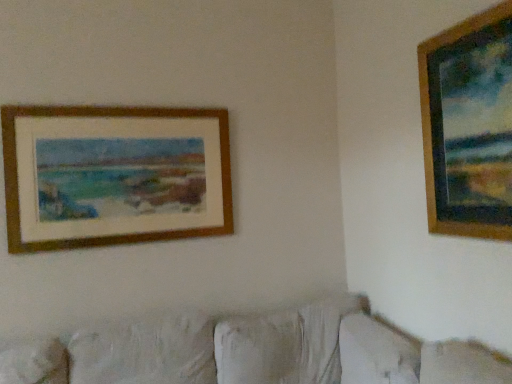
Where is `wooden frame at upper left, marked as the 1th picture frame in a back-to-front arrangement`? wooden frame at upper left, marked as the 1th picture frame in a back-to-front arrangement is located at coordinates (114, 175).

Is wooden frame at upper right, placed as the second picture frame when sorted from left to right, touching white fabric couch at lower center?

wooden frame at upper right, placed as the second picture frame when sorted from left to right, and white fabric couch at lower center are clearly separated.

Considering the relative sizes of wooden frame at upper right, arranged as the second picture frame when viewed from the back, and white fabric couch at lower center in the image provided, is wooden frame at upper right, arranged as the second picture frame when viewed from the back, bigger than white fabric couch at lower center?

No.

Does wooden frame at upper right, acting as the 1th picture frame starting from the front, contain white fabric couch at lower center?

That's incorrect, white fabric couch at lower center is not inside wooden frame at upper right, acting as the 1th picture frame starting from the front.

Which picture frame is the 1st one when counting from the back of the white fabric couch at lower center? Please provide its 2D coordinates.

[(449, 128)]

Looking at this image, from the image's perspective, is wooden frame at upper left, marked as the 1th picture frame in a back-to-front arrangement, on white fabric couch at lower center?

Yes.

Could you measure the distance between wooden frame at upper left, the 2th picture frame viewed from the right, and white fabric couch at lower center?

The distance of wooden frame at upper left, the 2th picture frame viewed from the right, from white fabric couch at lower center is 30.13 inches.

Between wooden frame at upper left, which appears as the second picture frame when viewed from the front, and white fabric couch at lower center, which one appears on the right side from the viewer's perspective?

white fabric couch at lower center is more to the right.

From a real-world perspective, which picture frame is the 1st one above the white fabric couch at lower center? Please provide its 2D coordinates.

[(114, 175)]

Between wooden frame at upper right, arranged as the second picture frame when viewed from the back, and wooden frame at upper left, which appears as the second picture frame when viewed from the front, which one has smaller size?

wooden frame at upper right, arranged as the second picture frame when viewed from the back, is smaller.

Considering the points (445, 227) and (80, 239), which point is behind, point (445, 227) or point (80, 239)?

The point (80, 239) is behind.

From a real-world perspective, which object stands above the other?

In real-world perspective, wooden frame at upper right, placed as the second picture frame when sorted from left to right, is above.

Which of these two, wooden frame at upper left, marked as the 1th picture frame in a back-to-front arrangement, or wooden frame at upper right, acting as the 1th picture frame starting from the front, is smaller?

wooden frame at upper right, acting as the 1th picture frame starting from the front, is smaller.

Does wooden frame at upper left, the first picture frame from the left, turn towards wooden frame at upper right, which is the 1th picture frame in right-to-left order?

No, wooden frame at upper left, the first picture frame from the left, is not facing towards wooden frame at upper right, which is the 1th picture frame in right-to-left order.

Which is less distant, [12,136] or [438,56]?

Point [12,136] appears to be farther away from the viewer than point [438,56].

Considering the points (173, 318) and (59, 158), which point is in front, point (173, 318) or point (59, 158)?

Point (59, 158)

How distant is white fabric couch at lower center from wooden frame at upper left, the first picture frame from the left?

They are 30.13 inches apart.

Based on the photo, is white fabric couch at lower center wider or thinner than wooden frame at upper left, the first picture frame from the left?

In the image, white fabric couch at lower center appears to be wider than wooden frame at upper left, the first picture frame from the left.

Is white fabric couch at lower center oriented towards wooden frame at upper left, which appears as the second picture frame when viewed from the front?

No.

Is white fabric couch at lower center smaller than wooden frame at upper right, which is the 1th picture frame in right-to-left order?

Incorrect, white fabric couch at lower center is not smaller in size than wooden frame at upper right, which is the 1th picture frame in right-to-left order.

Is there a large distance between white fabric couch at lower center and wooden frame at upper right, placed as the second picture frame when sorted from left to right?

They are positioned close to each other.

Consider the image. In the image, is white fabric couch at lower center positioned in front of or behind wooden frame at upper right, placed as the second picture frame when sorted from left to right?

white fabric couch at lower center is positioned closer to the viewer than wooden frame at upper right, placed as the second picture frame when sorted from left to right.

Is white fabric couch at lower center positioned with its back to wooden frame at upper right, which is the 1th picture frame in right-to-left order?

white fabric couch at lower center is not turned away from wooden frame at upper right, which is the 1th picture frame in right-to-left order.

Find the location of a particular element. This screenshot has width=512, height=384. couch lying in front of the wooden frame at upper right, which is the 1th picture frame in right-to-left order is located at coordinates (251, 352).

This screenshot has width=512, height=384. I want to click on couch that is below the wooden frame at upper left, the first picture frame from the left (from the image's perspective), so click(x=251, y=352).

From the picture: Which object lies nearer to the anchor point white fabric couch at lower center, wooden frame at upper right, acting as the 1th picture frame starting from the front, or wooden frame at upper left, the 2th picture frame viewed from the right?

wooden frame at upper left, the 2th picture frame viewed from the right, is positioned closer to the anchor white fabric couch at lower center.

From the image, which object appears to be farther from white fabric couch at lower center, wooden frame at upper left, the first picture frame from the left, or wooden frame at upper right, placed as the second picture frame when sorted from left to right?

Based on the image, wooden frame at upper right, placed as the second picture frame when sorted from left to right, appears to be further to white fabric couch at lower center.

Based on their spatial positions, is white fabric couch at lower center or wooden frame at upper right, placed as the second picture frame when sorted from left to right, further from wooden frame at upper left, the 2th picture frame viewed from the right?

wooden frame at upper right, placed as the second picture frame when sorted from left to right, lies further to wooden frame at upper left, the 2th picture frame viewed from the right, than the other object.

Consider the image. Estimate the real-world distances between objects in this image. Which object is further from wooden frame at upper right, arranged as the second picture frame when viewed from the back, white fabric couch at lower center or wooden frame at upper left, the first picture frame from the left?

The object further to wooden frame at upper right, arranged as the second picture frame when viewed from the back, is wooden frame at upper left, the first picture frame from the left.

When comparing their distances from wooden frame at upper right, which is the 1th picture frame in right-to-left order, does wooden frame at upper left, the 2th picture frame viewed from the right, or white fabric couch at lower center seem closer?

white fabric couch at lower center is positioned closer to the anchor wooden frame at upper right, which is the 1th picture frame in right-to-left order.

When comparing their distances from wooden frame at upper left, the first picture frame from the left, does wooden frame at upper right, which is the 1th picture frame in right-to-left order, or white fabric couch at lower center seem closer?

Based on the image, white fabric couch at lower center appears to be nearer to wooden frame at upper left, the first picture frame from the left.

Locate an element on the screen. Image resolution: width=512 pixels, height=384 pixels. couch between wooden frame at upper left, the 2th picture frame viewed from the right, and wooden frame at upper right, which is the 1th picture frame in right-to-left order is located at coordinates (251, 352).